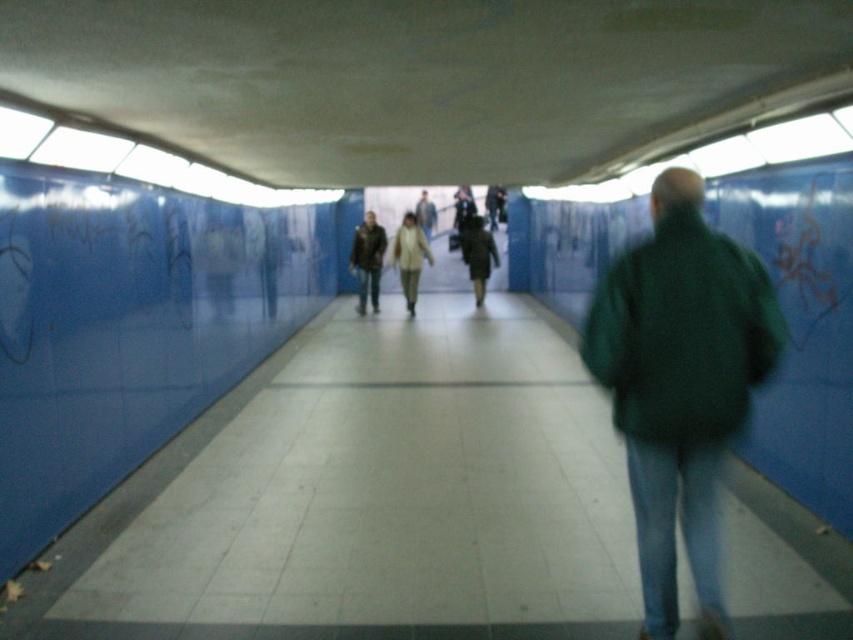
You are a person walking through the tunnel and notice two jackets. The green matte jacket at right and the matte brown jacket at center. Which jacket is smaller?

The green matte jacket at right is smaller than the matte brown jacket at center.

You are standing at the entrance of the tunnel and see the green matte jacket at right. If you want to reach the jacket, in which direction should you move relative to the tunnel? Please answer with a direction like left, right, forward, backward, up, or down.

Since the green matte jacket at right is located at point 0.600 on the x axis and 0.798 on the y axis, you should move forward to reach it.